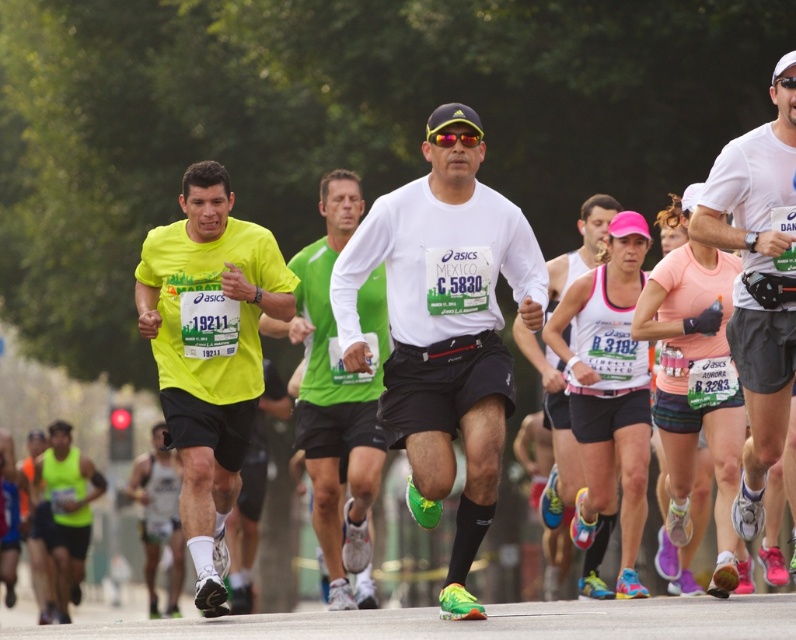
Is point (205, 528) farther from camera compared to point (80, 534)?

No, it is not.

Is neon yellow t-shirt at left shorter than matte green tank top at lower left?

Incorrect, neon yellow t-shirt at left's height does not fall short of matte green tank top at lower left's.

Is point (194, 268) behind point (73, 492)?

That is False.

Find the location of `neon yellow t-shirt at left`. neon yellow t-shirt at left is located at coordinates (209, 353).

Which is in front, point (353, 474) or point (584, 596)?

Point (353, 474)

Is point (354, 372) closer to viewer compared to point (544, 547)?

Yes, it is.

Where is `green fabric shirt at center`? Image resolution: width=796 pixels, height=640 pixels. green fabric shirt at center is located at coordinates (338, 392).

Does point (254, 308) lie in front of point (781, 358)?

No.

The width and height of the screenshot is (796, 640). Identify the location of neon yellow t-shirt at left. (209, 353).

This screenshot has width=796, height=640. Identify the location of neon yellow t-shirt at left. (209, 353).